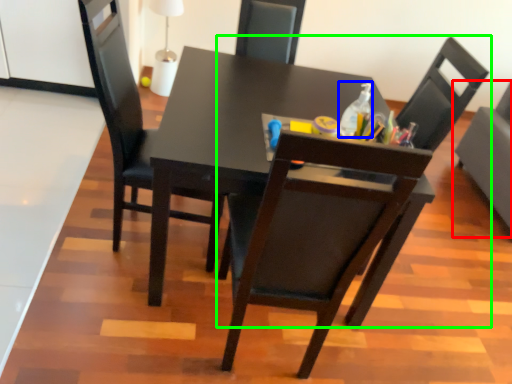
Question: Considering the real-world distances, which object is closest to chair (highlighted by a red box)? bottle (highlighted by a blue box) or chair (highlighted by a green box).

Choices:
 (A) bottle
 (B) chair

Answer: (B)